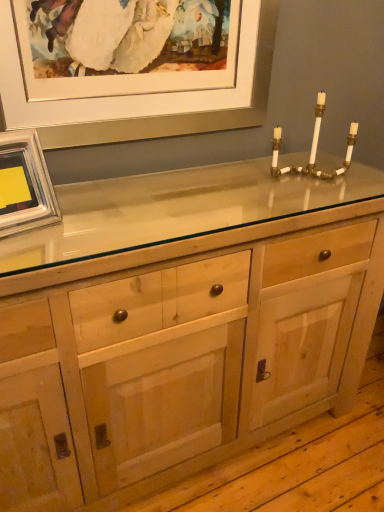
Where is `vacant space to the right of white ceramic candle holder at upper right`? The image size is (384, 512). vacant space to the right of white ceramic candle holder at upper right is located at coordinates (358, 180).